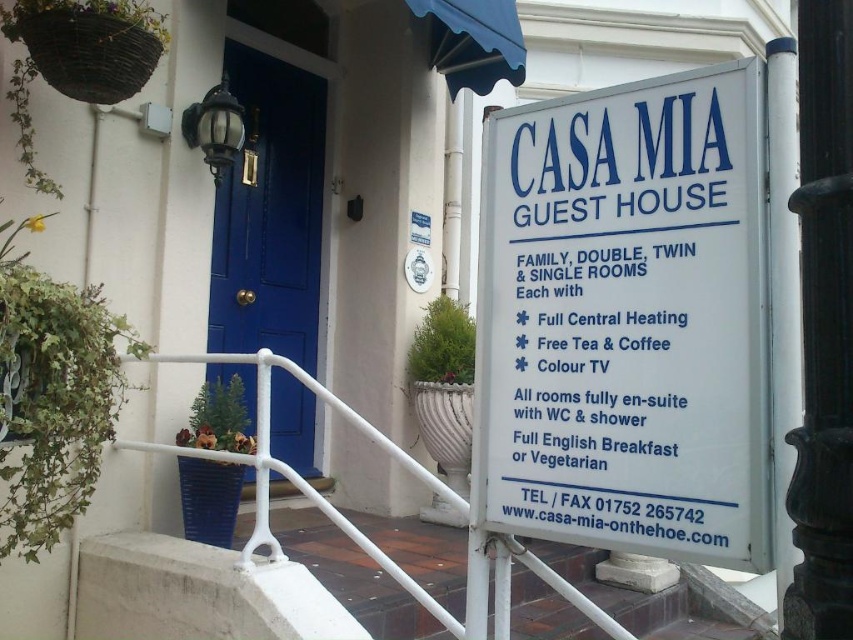
Question: Which point is farther to the camera?

Choices:
 (A) (790, 625)
 (B) (575, 230)

Answer: (B)

Question: Does white plastic sign at right have a smaller size compared to matte blue door at center?

Choices:
 (A) no
 (B) yes

Answer: (B)

Question: Which object is the closest to the matte blue door at center?

Choices:
 (A) black polished metal pole at right
 (B) white plastic sign at right

Answer: (B)

Question: Is white plastic sign at right positioned before matte blue door at center?

Choices:
 (A) yes
 (B) no

Answer: (A)

Question: Is white plastic sign at right to the left of matte blue door at center from the viewer's perspective?

Choices:
 (A) no
 (B) yes

Answer: (A)

Question: Among these objects, which one is nearest to the camera?

Choices:
 (A) white plastic sign at right
 (B) black polished metal pole at right
 (C) matte blue door at center

Answer: (B)